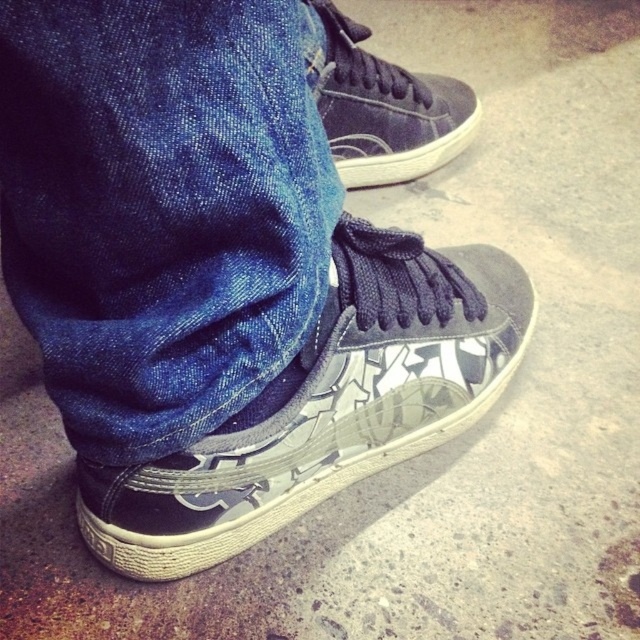
Question: Is glossy leather sneaker at lower center below matte black sneaker at center?

Choices:
 (A) no
 (B) yes

Answer: (B)

Question: Which point is farther to the camera?

Choices:
 (A) matte black sneaker at center
 (B) denim at center
 (C) glossy leather sneaker at lower center

Answer: (A)

Question: Where is denim at center located in relation to glossy leather sneaker at lower center in the image?

Choices:
 (A) right
 (B) left

Answer: (B)

Question: Does denim at center appear on the left side of glossy leather sneaker at lower center?

Choices:
 (A) no
 (B) yes

Answer: (B)

Question: Which object is closer to the camera taking this photo?

Choices:
 (A) denim at center
 (B) glossy leather sneaker at lower center

Answer: (A)

Question: Among these points, which one is farthest from the camera?

Choices:
 (A) (388, 83)
 (B) (116, 51)
 (C) (346, 380)

Answer: (A)